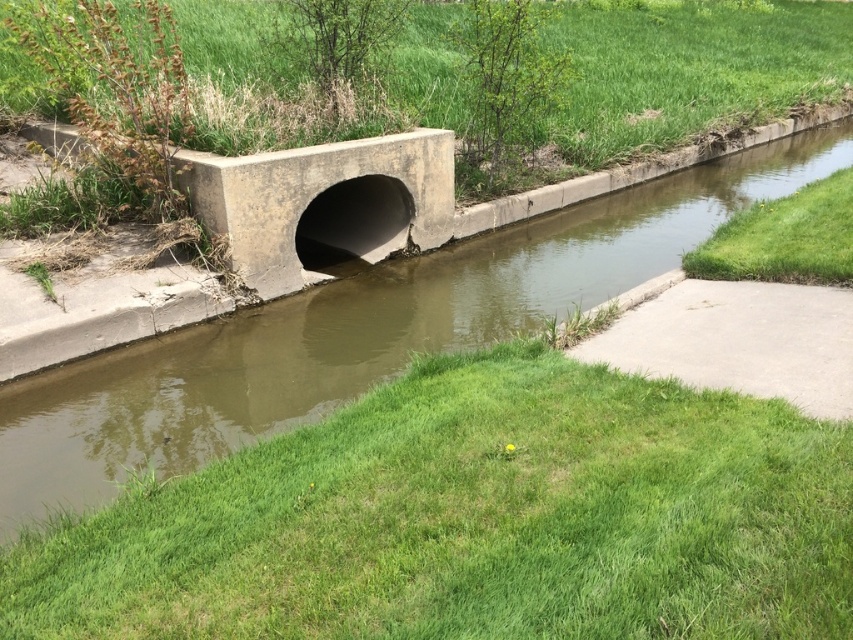
Question: Is green grass at lower center bigger than brown concrete stream at center?

Choices:
 (A) no
 (B) yes

Answer: (A)

Question: Which of the following is the closest to the observer?

Choices:
 (A) green grass at lower center
 (B) green grass at lower right

Answer: (A)

Question: Can you confirm if green grass at lower center is positioned below green grass at lower right?

Choices:
 (A) yes
 (B) no

Answer: (A)

Question: Among these points, which one is nearest to the camera?

Choices:
 (A) (695, 308)
 (B) (122, 577)
 (C) (727, 236)
 (D) (561, 212)

Answer: (B)

Question: Based on their relative distances, which object is farther from the green grass at lower center?

Choices:
 (A) brown concrete stream at center
 (B) green grass at lower right
 (C) gray concrete at lower right

Answer: (B)

Question: Is gray concrete at lower right closer to camera compared to green grass at lower right?

Choices:
 (A) no
 (B) yes

Answer: (B)